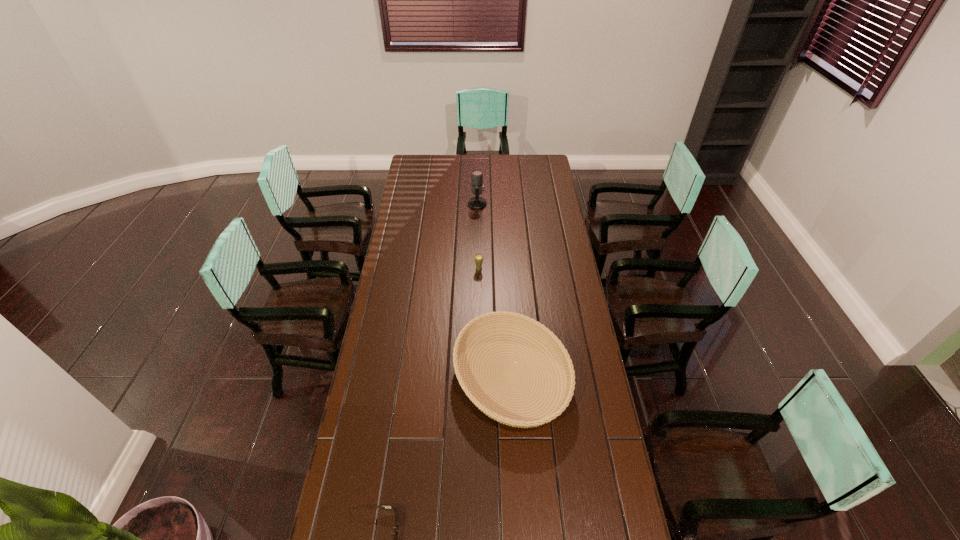
This screenshot has width=960, height=540. In the image, there is a desktop. In order to click on free space at the far edge in this screenshot , I will do `click(504, 163)`.

Where is `vacant area at the left edge of the desktop`? vacant area at the left edge of the desktop is located at coordinates (380, 461).

You are a GUI agent. You are given a task and a screenshot of the screen. Output one action in this format:
    pyautogui.click(x=<x>, y=<y>)
    Task: Click on the free space at the right edge of the desktop
    Image resolution: width=960 pixels, height=540 pixels.
    Given the screenshot: What is the action you would take?
    pyautogui.click(x=537, y=248)

In order to click on vacant region at the far left corner of the desktop in this screenshot , I will do `click(416, 158)`.

Identify the location of free space between the second shortest object and the second tallest object. Image resolution: width=960 pixels, height=540 pixels. (495, 323).

Where is `free spot between the second tallest object and the basket`? The image size is (960, 540). free spot between the second tallest object and the basket is located at coordinates (495, 323).

Identify the location of unoccupied position between the farthest object and the second shortest object. point(494,291).

Locate an element on the screen. The image size is (960, 540). unoccupied position between the third shortest object and the third tallest object is located at coordinates (495, 323).

What are the coordinates of `vacant area that lies between the farthest object and the third farthest object` in the screenshot? It's located at (494, 291).

Find the location of a particular element. unoccupied area between the microphone and the second nearest object is located at coordinates (494, 291).